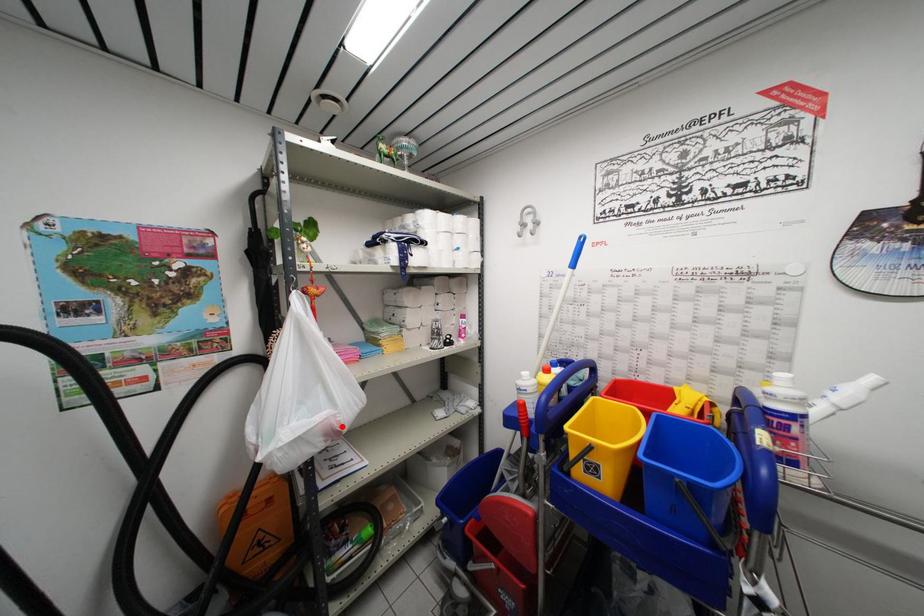
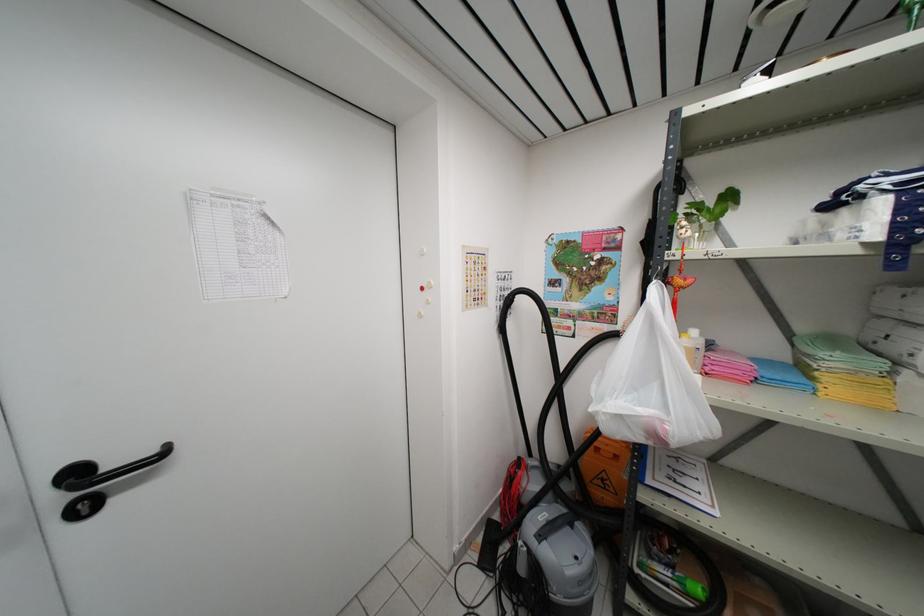
Locate, in the second image, the point that corresponds to the highlighted location in the first image.

(670, 435)